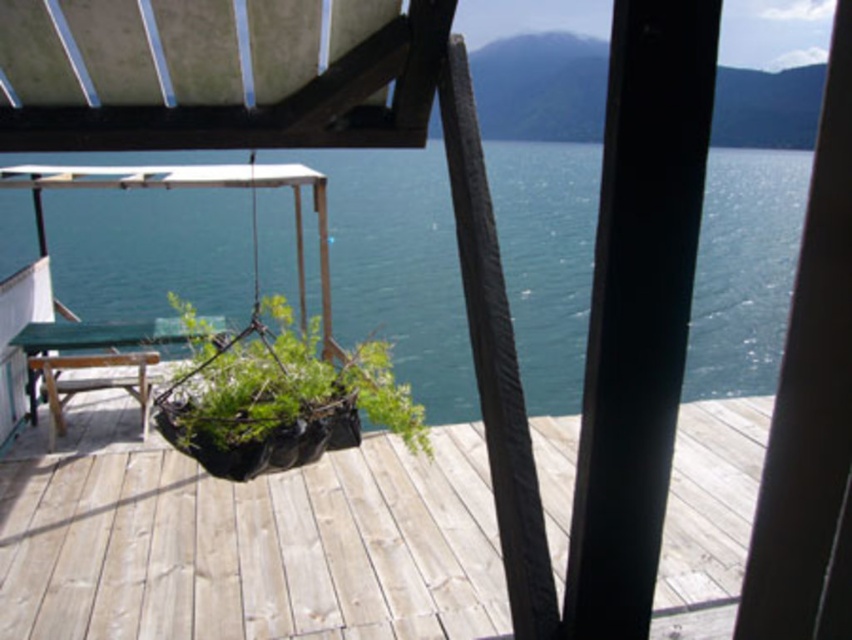
Question: Which point is closer to the camera?

Choices:
 (A) (95, 269)
 (B) (164, 433)

Answer: (B)

Question: Can you confirm if wooden at center is positioned to the left of black fabric plant at center?

Choices:
 (A) no
 (B) yes

Answer: (B)

Question: Is wooden at center positioned at the back of blue water at center?

Choices:
 (A) yes
 (B) no

Answer: (A)

Question: Where is wooden at center located in relation to black fabric plant at center in the image?

Choices:
 (A) right
 (B) left

Answer: (B)

Question: Which object appears closest to the camera in this image?

Choices:
 (A) wooden at center
 (B) black fabric plant at center
 (C) blue water at center

Answer: (C)

Question: Which of the following is the closest to the observer?

Choices:
 (A) (547, 216)
 (B) (200, 378)

Answer: (B)